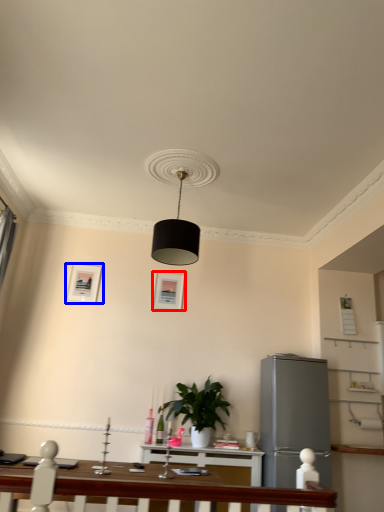
Question: Which object is closer to the camera taking this photo, picture frame (highlighted by a red box) or picture frame (highlighted by a blue box)?

Choices:
 (A) picture frame
 (B) picture frame

Answer: (B)